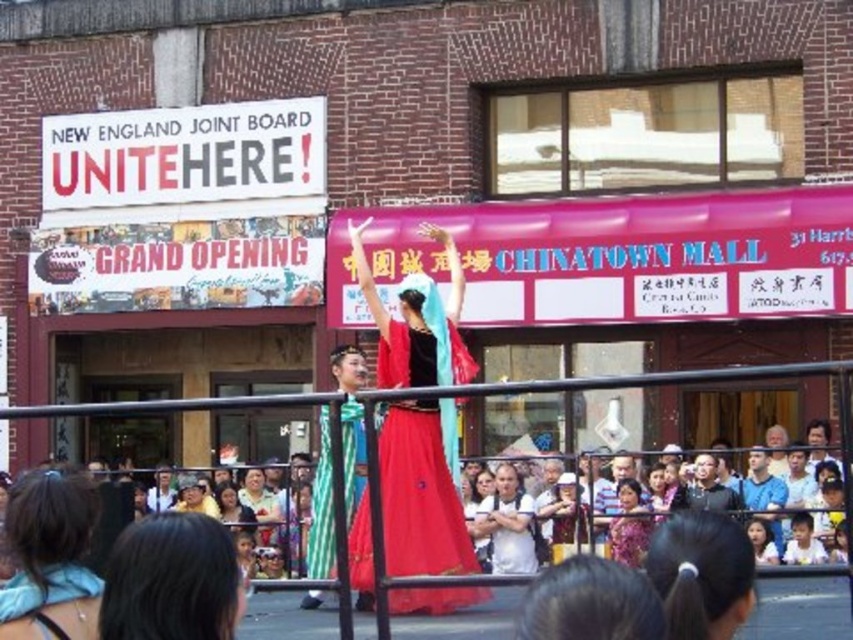
You are a photographer standing at the edge of the crowd. You want to take a photo of the white cotton shirt at center. According to the coordinates given, where should you aim your camera?

You should aim your camera at point 0.819 on the x axis and 0.596 on the y axis to capture the white cotton shirt at center.

You are a photographer at the event and want to capture a clear photo of the matte green scarf at center without the floral fabric dress at center blocking it. Is this possible?

The floral fabric dress at center is positioned over matte green scarf at center, so it will block the view of the scarf. You cannot capture a clear photo of the matte green scarf at center without the floral fabric dress at center blocking it.

You are a photographer at the event and want to capture both the floral fabric dress at center and the matte green scarf at center in a single frame. Given their spatial relationship, which object should you focus on to ensure both are clearly visible in the photo?

Since the floral fabric dress at center occupies less space than the matte green scarf at center, you should focus on the floral fabric dress at center to ensure both objects are clearly visible in the photo.